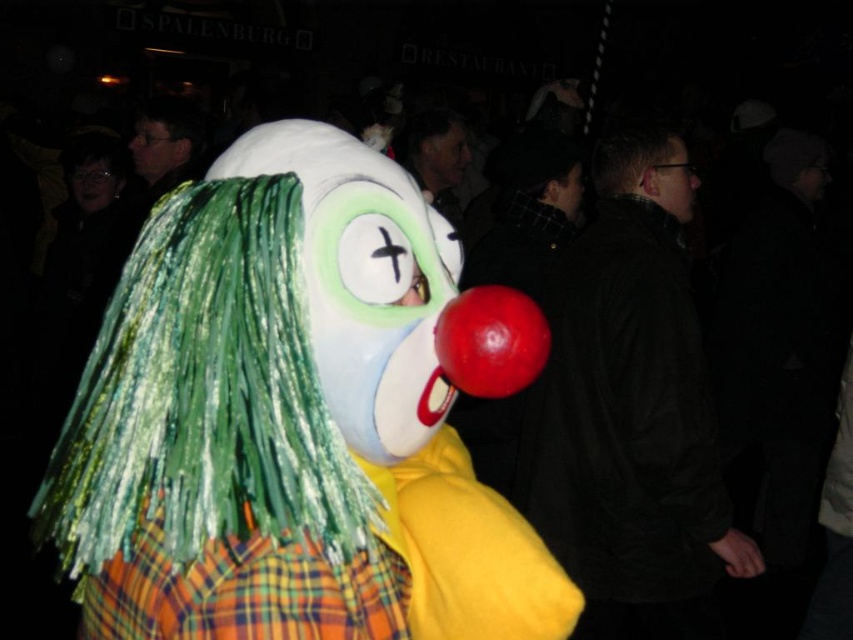
Question: Considering the relative positions of matte black jacket at upper left and matte red clown nose at upper center in the image provided, where is matte black jacket at upper left located with respect to matte red clown nose at upper center?

Choices:
 (A) left
 (B) right

Answer: (A)

Question: Which of the following is the closest to the observer?

Choices:
 (A) (577, 180)
 (B) (422, 250)

Answer: (B)

Question: Which point is farther to the camera?

Choices:
 (A) matte green wig at center
 (B) matte white face at center

Answer: (B)

Question: Which point is closer to the camera?

Choices:
 (A) matte white face at center
 (B) matte black glasses at upper left

Answer: (B)

Question: Does matte black glasses at upper right come behind matte black glasses at upper left?

Choices:
 (A) yes
 (B) no

Answer: (B)

Question: Does matte green wig at upper left appear on the left side of rubber/red clown nose at center?

Choices:
 (A) no
 (B) yes

Answer: (A)